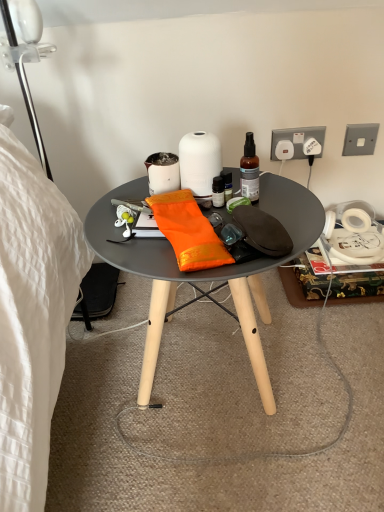
The width and height of the screenshot is (384, 512). What do you see at coordinates (188, 231) in the screenshot?
I see `orange silk cloth at center` at bounding box center [188, 231].

Where is `white matte vase at center`? white matte vase at center is located at coordinates (199, 162).

Measure the distance between translucent glass spray bottle at upper right and camera.

translucent glass spray bottle at upper right is 86.90 centimeters away from camera.

Find the location of a particular element. translucent glass spray bottle at upper right is located at coordinates (249, 170).

Describe the element at coordinates (162, 172) in the screenshot. This screenshot has width=384, height=512. I see `matte white coffee cup at center` at that location.

Where is `white plastic power outlet at upper right, which ranks as the 4th power outlet in right-to-left order`? white plastic power outlet at upper right, which ranks as the 4th power outlet in right-to-left order is located at coordinates (284, 150).

At what (x,y) coordinates should I click in order to perform the action: click on toilet paper lying above the matte white coffee cup at center (from the image's perspective). Please return your answer as a coordinate pair (x, y). The image size is (384, 512). Looking at the image, I should click on (199, 162).

Which of these two, white matte vase at center or matte white coffee cup at center, is wider?

Wider between the two is white matte vase at center.

Is white matte vase at center to the left of matte white coffee cup at center from the viewer's perspective?

Incorrect, white matte vase at center is not on the left side of matte white coffee cup at center.

Considering the sizes of objects white matte vase at center and matte white coffee cup at center in the image provided, who is shorter, white matte vase at center or matte white coffee cup at center?

Standing shorter between the two is matte white coffee cup at center.

Consider the image. Looking at the image, does matte white coffee cup at center seem bigger or smaller compared to matte black table at center?

Clearly, matte white coffee cup at center is smaller in size than matte black table at center.

Who is more distant, matte white coffee cup at center or matte black table at center?

matte white coffee cup at center is behind.

Does matte white coffee cup at center appear on the left side of matte black table at center?

Yes.

Considering the sizes of objects matte white coffee cup at center and matte black table at center in the image provided, who is shorter, matte white coffee cup at center or matte black table at center?

With less height is matte white coffee cup at center.

In the scene shown: Which is more to the left, matte white coffee cup at center or orange silk cloth at center?

matte white coffee cup at center.

I want to click on coffee cup behind the orange silk cloth at center, so click(162, 172).

Which is in front, point (159, 184) or point (204, 229)?

The point (204, 229) is in front.

Is matte white coffee cup at center inside or outside of orange silk cloth at center?

matte white coffee cup at center is not enclosed by orange silk cloth at center.

Considering the positions of objects transparent plastic lamp at upper left and matte white coffee cup at center in the image provided, who is more to the left, transparent plastic lamp at upper left or matte white coffee cup at center?

From the viewer's perspective, transparent plastic lamp at upper left appears more on the left side.

Which is correct: transparent plastic lamp at upper left is inside matte white coffee cup at center, or outside of it?

transparent plastic lamp at upper left is not enclosed by matte white coffee cup at center.

From a real-world perspective, is transparent plastic lamp at upper left above or below matte white coffee cup at center?

Clearly, from a real-world perspective, transparent plastic lamp at upper left is above matte white coffee cup at center.

Is transparent plastic lamp at upper left touching matte white coffee cup at center?

transparent plastic lamp at upper left and matte white coffee cup at center are clearly separated.

Is point (365, 138) more distant than point (25, 53)?

Yes, point (365, 138) is behind point (25, 53).

Relative to transparent plastic lamp at upper left, is metallic silver power outlet at upper right, marked as the 4th power outlet in a left-to-right arrangement, in front or behind?

Visually, metallic silver power outlet at upper right, marked as the 4th power outlet in a left-to-right arrangement, is located behind transparent plastic lamp at upper left.

Is metallic silver power outlet at upper right, marked as the 4th power outlet in a left-to-right arrangement, bigger or smaller than transparent plastic lamp at upper left?

Clearly, metallic silver power outlet at upper right, marked as the 4th power outlet in a left-to-right arrangement, is smaller in size than transparent plastic lamp at upper left.

Measure the distance from white plastic power outlet at upper right, which ranks as the 4th power outlet in right-to-left order, to white plastic power outlet at upper right, which appears as the 2th power outlet when viewed from the right.

white plastic power outlet at upper right, which ranks as the 4th power outlet in right-to-left order, is 2.19 inches from white plastic power outlet at upper right, which appears as the 2th power outlet when viewed from the right.

In the scene shown: From a real-world perspective, which is physically below, white plastic power outlet at upper right, which appears as the 1th power outlet when viewed from the left, or white plastic power outlet at upper right, the 3th power outlet when ordered from left to right?

In real-world perspective, white plastic power outlet at upper right, which appears as the 1th power outlet when viewed from the left, is lower.

Does white plastic power outlet at upper right, which appears as the 1th power outlet when viewed from the left, have a larger size compared to white plastic power outlet at upper right, the 3th power outlet when ordered from left to right?

Indeed, white plastic power outlet at upper right, which appears as the 1th power outlet when viewed from the left, has a larger size compared to white plastic power outlet at upper right, the 3th power outlet when ordered from left to right.

Which object is closer to the camera taking this photo, white plastic power outlet at upper right, which ranks as the 4th power outlet in right-to-left order, or white plastic power outlet at upper right, the 3th power outlet when ordered from left to right?

white plastic power outlet at upper right, the 3th power outlet when ordered from left to right, is more forward.

From the image's perspective, does white plastic power outlet at upper right, which ranks as the 3th power outlet in right-to-left order, appear higher than white matte vase at center?

Correct, white plastic power outlet at upper right, which ranks as the 3th power outlet in right-to-left order, appears higher than white matte vase at center in the image.

Considering the positions of points (275, 158) and (182, 154), is point (275, 158) farther from camera compared to point (182, 154)?

Yes, it is.

Does white plastic power outlet at upper right, positioned as the second power outlet in left-to-right order, have a greater width compared to white matte vase at center?

No, white plastic power outlet at upper right, positioned as the second power outlet in left-to-right order, is not wider than white matte vase at center.

Locate an element on the screen. The image size is (384, 512). coffee cup on the left side of white matte vase at center is located at coordinates (162, 172).

At what (x,y) coordinates should I click in order to perform the action: click on coffee cup behind the matte black table at center. Please return your answer as a coordinate pair (x, y). Looking at the image, I should click on (162, 172).

Estimate the real-world distances between objects in this image. Which object is further from white plastic power outlet at upper right, which ranks as the 3th power outlet in right-to-left order, white matte vase at center or orange silk cloth at center?

orange silk cloth at center is positioned further to the anchor white plastic power outlet at upper right, which ranks as the 3th power outlet in right-to-left order.

Considering their positions, is orange silk cloth at center positioned closer to white plastic power outlet at upper right, which ranks as the 3th power outlet in right-to-left order, than translucent glass spray bottle at upper right?

translucent glass spray bottle at upper right.

Estimate the real-world distances between objects in this image. Which object is further from white plastic power outlet at upper right, which ranks as the 3th power outlet in right-to-left order, white plastic power outlet at upper right, the 3th power outlet when ordered from left to right, or translucent glass spray bottle at upper right?

Among the two, translucent glass spray bottle at upper right is located further to white plastic power outlet at upper right, which ranks as the 3th power outlet in right-to-left order.

From the image, which object appears to be farther from transparent plastic lamp at upper left, translucent glass spray bottle at upper right or matte black table at center?

translucent glass spray bottle at upper right is positioned further to the anchor transparent plastic lamp at upper left.

Looking at the image, which one is located further to white matte vase at center, white plastic power outlet at upper right, which appears as the 2th power outlet when viewed from the right, or white plastic power outlet at upper right, which appears as the 1th power outlet when viewed from the left?

white plastic power outlet at upper right, which appears as the 2th power outlet when viewed from the right, is positioned further to the anchor white matte vase at center.

From the picture: From the image, which object appears to be nearer to matte black table at center, white matte vase at center or metallic silver power outlet at upper right, acting as the first power outlet starting from the right?

The object closer to matte black table at center is white matte vase at center.

In the scene shown: Based on their spatial positions, is matte black table at center or white plastic power outlet at upper right, which appears as the 1th power outlet when viewed from the left, closer to white matte vase at center?

matte black table at center is positioned closer to the anchor white matte vase at center.

Looking at the image, which one is located closer to white plastic power outlet at upper right, positioned as the second power outlet in left-to-right order, matte white coffee cup at center or metallic silver power outlet at upper right, acting as the first power outlet starting from the right?

metallic silver power outlet at upper right, acting as the first power outlet starting from the right, lies closer to white plastic power outlet at upper right, positioned as the second power outlet in left-to-right order, than the other object.

Locate an element on the screen. Image resolution: width=384 pixels, height=512 pixels. toilet paper between matte white coffee cup at center and metallic silver power outlet at upper right, marked as the 4th power outlet in a left-to-right arrangement is located at coordinates tap(199, 162).

You are a GUI agent. You are given a task and a screenshot of the screen. Output one action in this format:
    pyautogui.click(x=<x>, y=<y>)
    Task: Click on the material between matte black table at center and white plastic power outlet at upper right, which appears as the 1th power outlet when viewed from the left, in the front-back direction
    The image size is (384, 512).
    Given the screenshot: What is the action you would take?
    pyautogui.click(x=188, y=231)

The width and height of the screenshot is (384, 512). I want to click on material positioned between matte black table at center and matte white coffee cup at center from near to far, so click(x=188, y=231).

You are a GUI agent. You are given a task and a screenshot of the screen. Output one action in this format:
    pyautogui.click(x=<x>, y=<y>)
    Task: Click on the toilet paper situated between transparent plastic lamp at upper left and white plastic power outlet at upper right, which ranks as the 4th power outlet in right-to-left order, from left to right
    
    Given the screenshot: What is the action you would take?
    pyautogui.click(x=199, y=162)